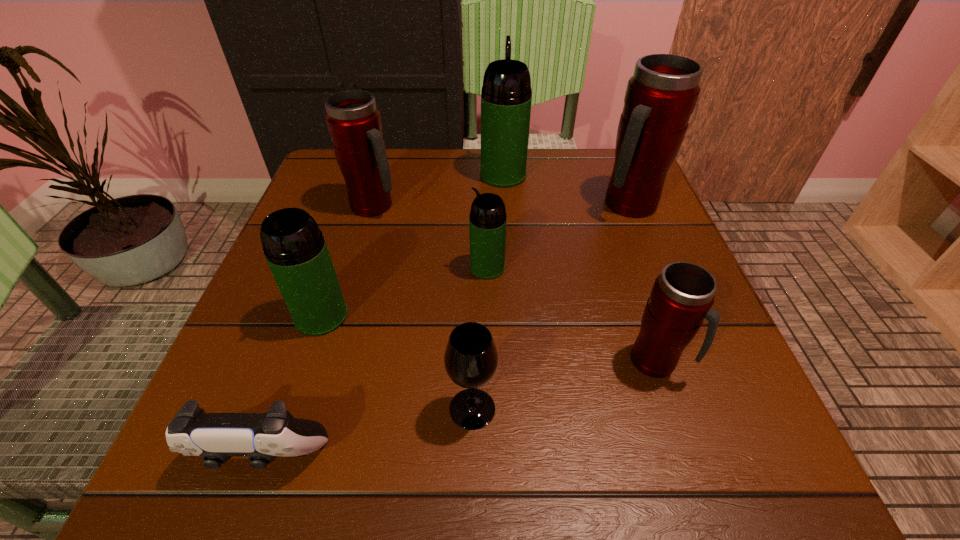
The image size is (960, 540). What are the coordinates of `the biggest green thermos bottle` in the screenshot? It's located at click(506, 95).

The height and width of the screenshot is (540, 960). Identify the location of the biggest red thermos bottle. (660, 97).

At what (x,y) coordinates should I click in order to perform the action: click on the nearest green thermos bottle. Please return your answer as a coordinate pair (x, y). This screenshot has width=960, height=540. Looking at the image, I should click on (295, 249).

Identify the location of the second nearest thermos bottle. 295,249.

This screenshot has width=960, height=540. I want to click on the second smallest red thermos bottle, so click(x=354, y=122).

Locate an element on the screen. This screenshot has height=540, width=960. the smallest green thermos bottle is located at coordinates (487, 223).

At what (x,y) coordinates should I click in order to perform the action: click on the fourth farthest object. Please return your answer as a coordinate pair (x, y). Looking at the image, I should click on (487, 223).

Find the location of a particular element. This screenshot has width=960, height=540. the nearest thermos bottle is located at coordinates (682, 295).

Identify the location of the smallest red thermos bottle. The height and width of the screenshot is (540, 960). (682, 295).

The height and width of the screenshot is (540, 960). What are the coordinates of `wineglass` in the screenshot? It's located at (x=471, y=359).